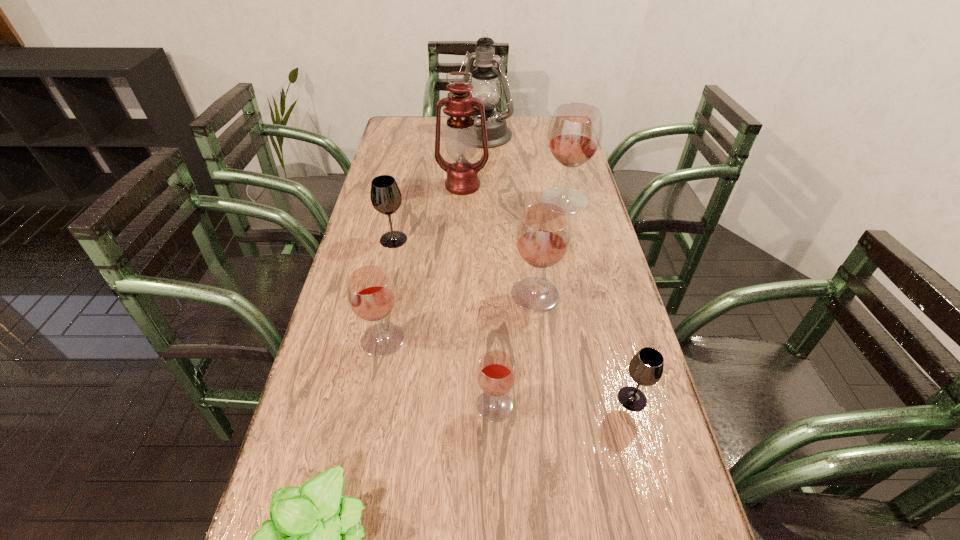
Where is `red oil lamp`? red oil lamp is located at coordinates (461, 140).

Where is `the farther oil lamp`? This screenshot has height=540, width=960. the farther oil lamp is located at coordinates (486, 87).

Find the location of a particular element. the tallest wineglass is located at coordinates (575, 131).

At what (x,y) coordinates should I click in order to perform the action: click on the biggest red wineglass. Please return your answer as a coordinate pair (x, y). Looking at the image, I should click on (575, 131).

I want to click on the second biggest red wineglass, so click(x=543, y=234).

Where is `the fifth farthest object`? The height and width of the screenshot is (540, 960). the fifth farthest object is located at coordinates (543, 234).

In order to click on the sixth farthest object in this screenshot , I will do `click(371, 295)`.

Find the location of a particular element. This screenshot has width=960, height=540. the third nearest wineglass is located at coordinates (371, 295).

You are a GUI agent. You are given a task and a screenshot of the screen. Output one action in this format:
    pyautogui.click(x=<x>, y=<y>)
    Task: Click on the fourth farthest object
    
    Given the screenshot: What is the action you would take?
    pyautogui.click(x=385, y=195)

You are a GUI agent. You are given a task and a screenshot of the screen. Output one action in this format:
    pyautogui.click(x=<x>, y=<y>)
    Task: Click on the left gray wineglass
    Image resolution: width=960 pixels, height=540 pixels.
    Given the screenshot: What is the action you would take?
    pyautogui.click(x=385, y=195)